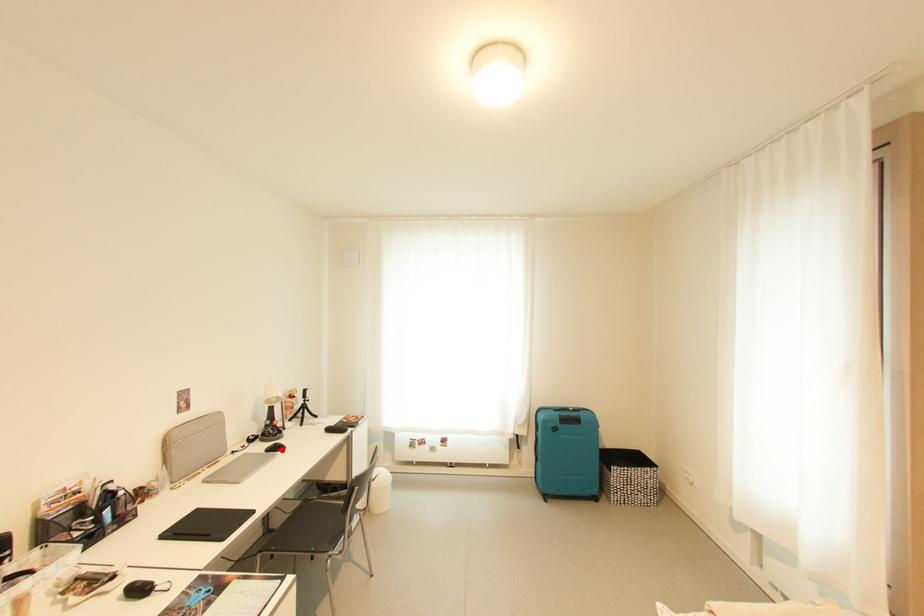
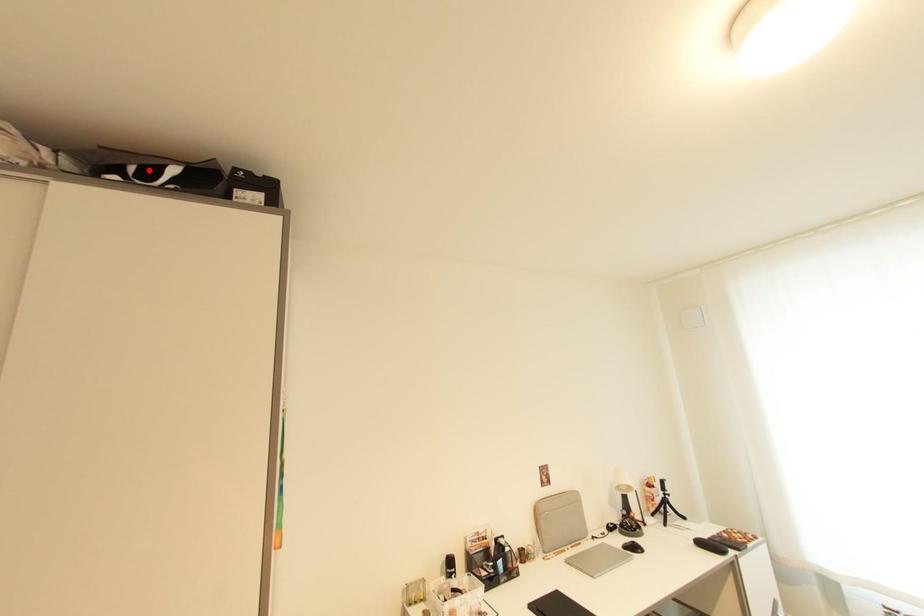
I am providing you with two images of the same scene from different viewpoints. A red point is marked on the first image and another point is marked on the second image. Is the marked point in image1 the same physical position as the marked point in image2?

No